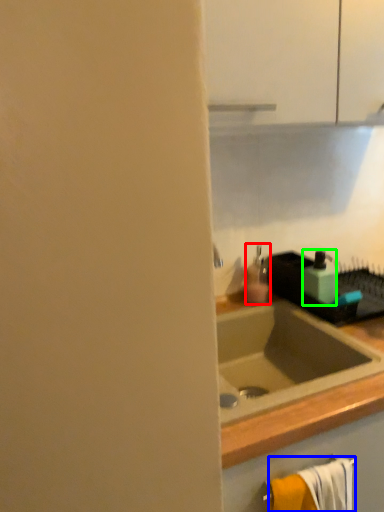
Question: Which object is positioned farthest from soap dispenser (highlighted by a red box)? Select from bath towel (highlighted by a blue box) and soap dispenser (highlighted by a green box).

Choices:
 (A) bath towel
 (B) soap dispenser

Answer: (A)